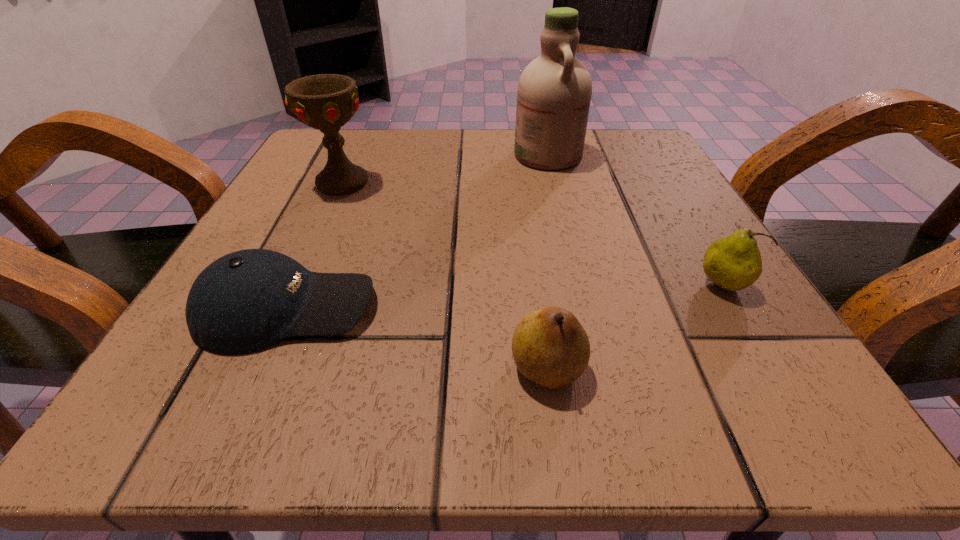
The width and height of the screenshot is (960, 540). Identify the location of cleansing agent. (554, 92).

This screenshot has height=540, width=960. Identify the location of the second tallest object. tap(326, 102).

In order to click on the nearer pear in this screenshot , I will do pyautogui.click(x=550, y=347).

The width and height of the screenshot is (960, 540). What are the coordinates of `the farther pear` in the screenshot? It's located at (734, 262).

Locate an element on the screen. The image size is (960, 540). the right pear is located at coordinates (x=734, y=262).

At what (x,y) coordinates should I click in order to perform the action: click on the shortest object. Please return your answer as a coordinate pair (x, y). Image resolution: width=960 pixels, height=540 pixels. Looking at the image, I should click on (245, 301).

The width and height of the screenshot is (960, 540). Find the location of `free space located 0.270m on the front label of the cleansing agent`. free space located 0.270m on the front label of the cleansing agent is located at coordinates pyautogui.click(x=380, y=156).

The image size is (960, 540). In order to click on vacant region located 0.200m on the front label of the cleansing agent in this screenshot , I will do `click(415, 156)`.

In order to click on free space located 0.320m on the front label of the cleansing agent in this screenshot , I will do click(356, 156).

Where is `blank space located on the front of the fourth shortest object`? blank space located on the front of the fourth shortest object is located at coordinates (297, 284).